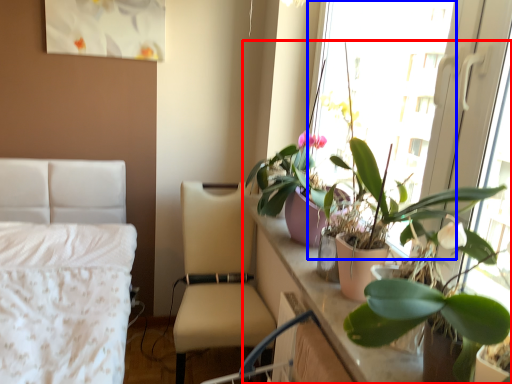
Question: Which object is further to the camera taking this photo, houseplant (highlighted by a red box) or window screen (highlighted by a blue box)?

Choices:
 (A) houseplant
 (B) window screen

Answer: (B)